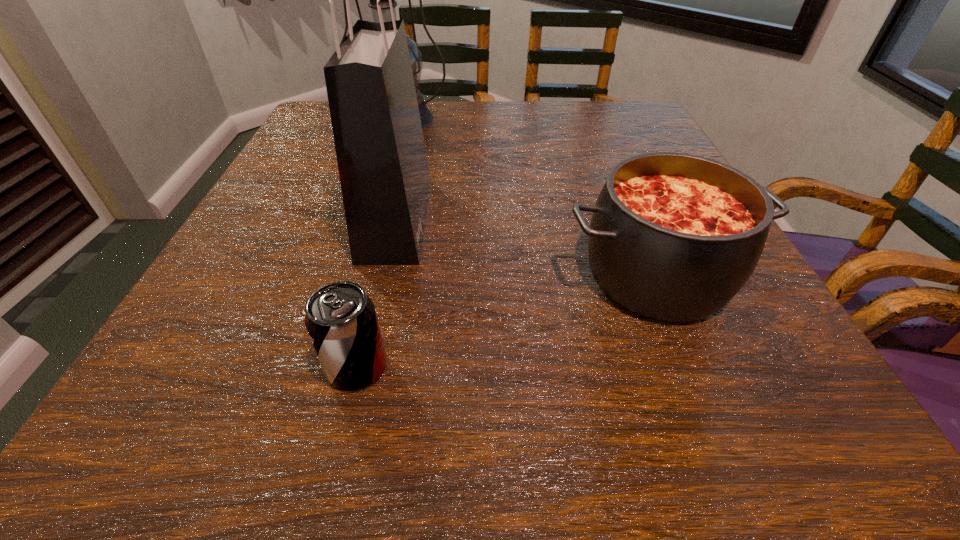
You are a GUI agent. You are given a task and a screenshot of the screen. Output one action in this format:
    pyautogui.click(x=<x>, y=<y>)
    Task: Click on the oil lamp
    This screenshot has height=540, width=960.
    Given the screenshot: What is the action you would take?
    pos(426,116)

Locate an element on the screen. shopping bag is located at coordinates (385, 180).

Find the location of a particular element. The width and height of the screenshot is (960, 540). the second shortest object is located at coordinates (673, 236).

Locate an element on the screen. This screenshot has height=540, width=960. the rightmost object is located at coordinates (673, 236).

Where is `the shortest object`? This screenshot has height=540, width=960. the shortest object is located at coordinates (341, 320).

What are the coordinates of `soda can` in the screenshot? It's located at (341, 320).

Where is `free space located on the front of the oil lamp`? free space located on the front of the oil lamp is located at coordinates (371, 207).

This screenshot has height=540, width=960. What are the coordinates of `vacant space situated on the front with handles of the shopping bag` in the screenshot? It's located at (549, 219).

Find the location of a particular element. vacant region located 0.330m on the left of the third tallest object is located at coordinates (357, 275).

Image resolution: width=960 pixels, height=540 pixels. In order to click on vacant space situated 0.180m on the left of the nearest object in this screenshot , I will do `click(192, 367)`.